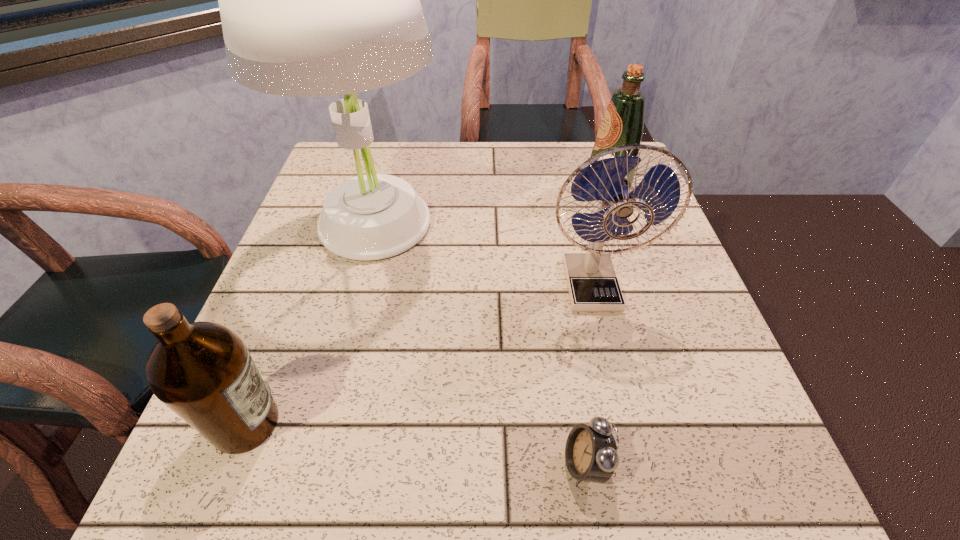
Locate an element on the screen. Image resolution: width=960 pixels, height=540 pixels. vacant space situated on the label of the nearer olive oil is located at coordinates (323, 423).

I want to click on vacant position located on the face of the shortest object, so click(335, 464).

Image resolution: width=960 pixels, height=540 pixels. In order to click on free point located on the face of the shortest object in this screenshot , I will do `click(393, 464)`.

The image size is (960, 540). I want to click on vacant area located 0.350m on the face of the shortest object, so click(314, 464).

At what (x,y) coordinates should I click in order to perform the action: click on lamp that is at the far edge. Please return your answer as a coordinate pair (x, y). The height and width of the screenshot is (540, 960). Looking at the image, I should click on (316, 0).

You are a GUI agent. You are given a task and a screenshot of the screen. Output one action in this format:
    pyautogui.click(x=<x>, y=<y>)
    Task: Click on the olive oil that is at the far edge
    
    Given the screenshot: What is the action you would take?
    pyautogui.click(x=623, y=122)

The width and height of the screenshot is (960, 540). Identify the location of olive oil positioned at the near edge. (203, 371).

Locate an element on the screen. Image resolution: width=960 pixels, height=540 pixels. alarm clock located in the near edge section of the desktop is located at coordinates (591, 455).

At what (x,y) coordinates should I click in order to perform the action: click on lamp positioned at the left edge. Please return your answer as a coordinate pair (x, y). The width and height of the screenshot is (960, 540). Looking at the image, I should click on (316, 0).

Where is `olive oil that is positioned at the left edge`? The width and height of the screenshot is (960, 540). olive oil that is positioned at the left edge is located at coordinates (203, 371).